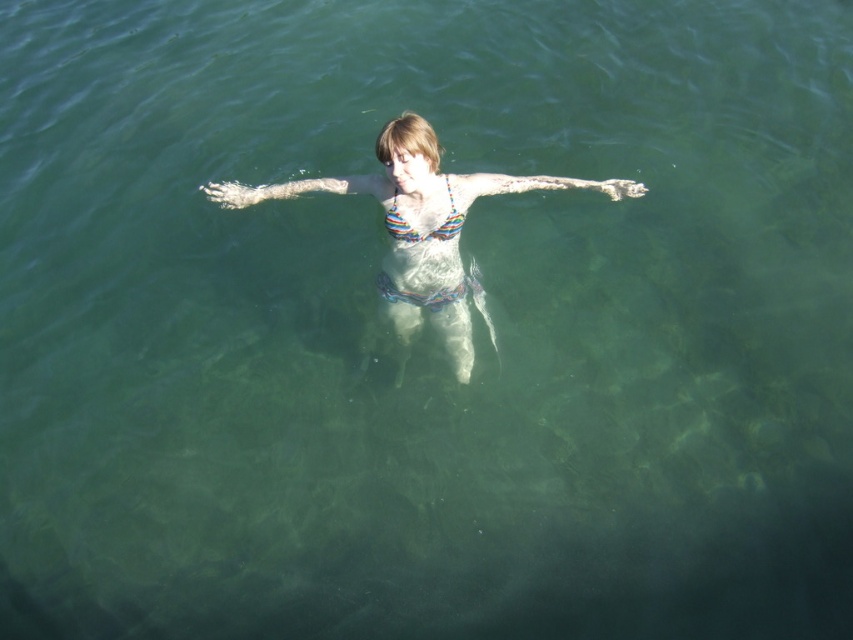
You are a photographer taking a picture of the white matte skin at center and the rainbow striped bikini top at center. Which object will appear larger in the photo?

The white matte skin at center will appear larger in the photo because it is closer to the viewer than the rainbow striped bikini top at center.

You are a lifeguard on duty and need to assess if the person in the water is in a safe position. Given that the recommended safety distance between the swimmer and the edge of the pool is at least 12 inches, can you determine if the multicolored bikini at center and white matte skin at center are within the safe distance?

The distance between the multicolored bikini at center and white matte skin at center is 13.34 inches, which exceeds the recommended safety distance of 12 inches. Therefore, the swimmer is within the safe zone.

You are a photographer capturing a person floating in the water. You notice the white matte skin at center and the rainbow striped bikini top at center. Which object is closer to the camera?

The white matte skin at center is positioned over the rainbow striped bikini top at center, so it is closer to the camera.